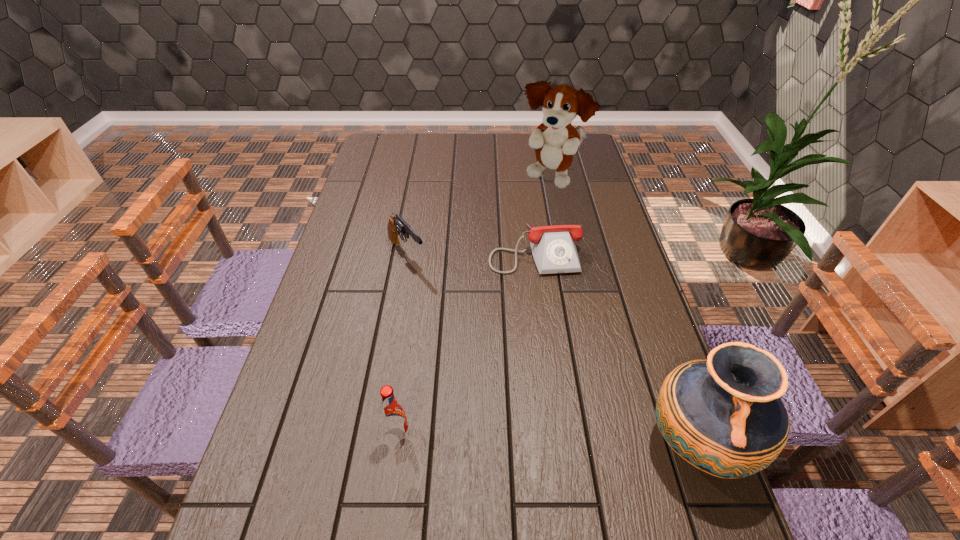
Select which object is the fourth closest to the fourth tallest object. Please provide its 2D coordinates. Your answer should be formatted as a tuple, i.e. [(x, y)], where the tuple contains the x and y coordinates of a point satisfying the conditions above.

[(724, 416)]

Identify the location of free space in the image that satisfies the following two spatial constraints: 1. on the front side of the fourth tallest object; 2. on the left side of the root beer. Image resolution: width=960 pixels, height=540 pixels. (374, 435).